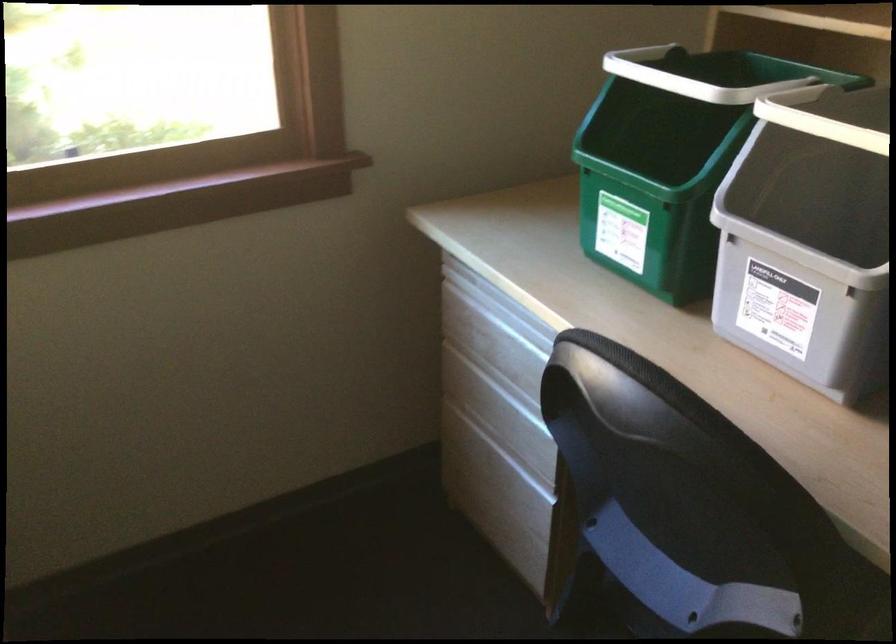
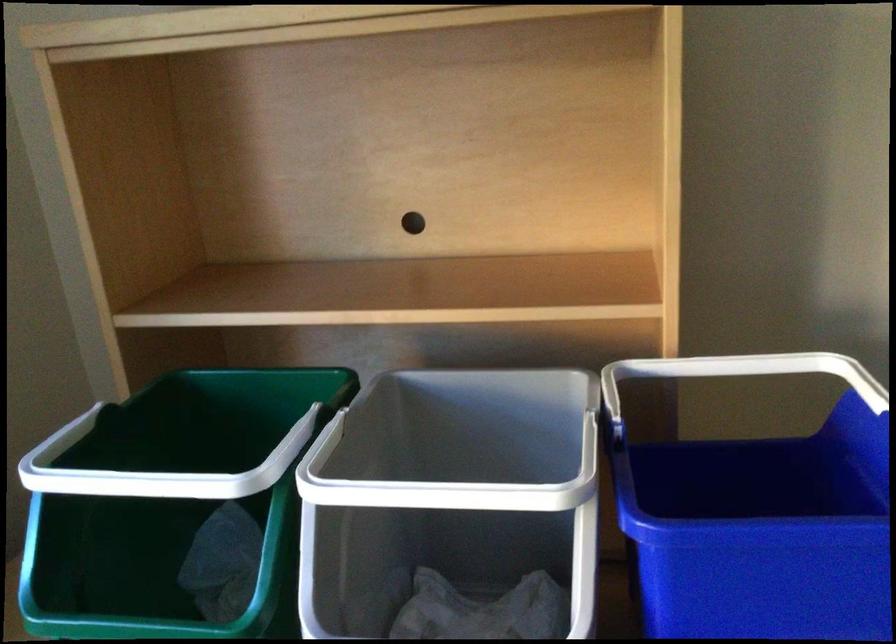
Question: Based on the continuous images, in which direction is the camera rotating? Reply with the corresponding letter.

Choices:
 (A) Left
 (B) Right
 (C) Up
 (D) Down

Answer: (B)